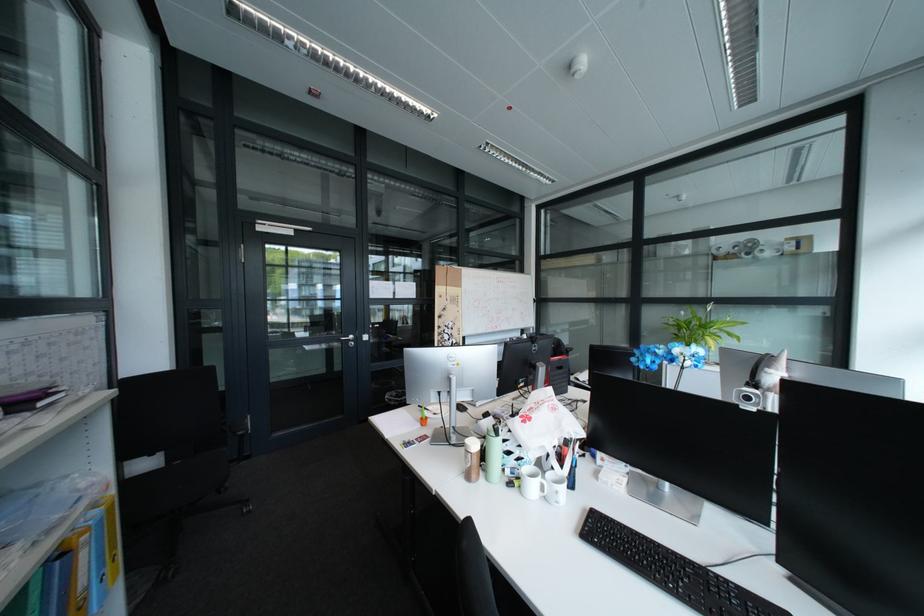
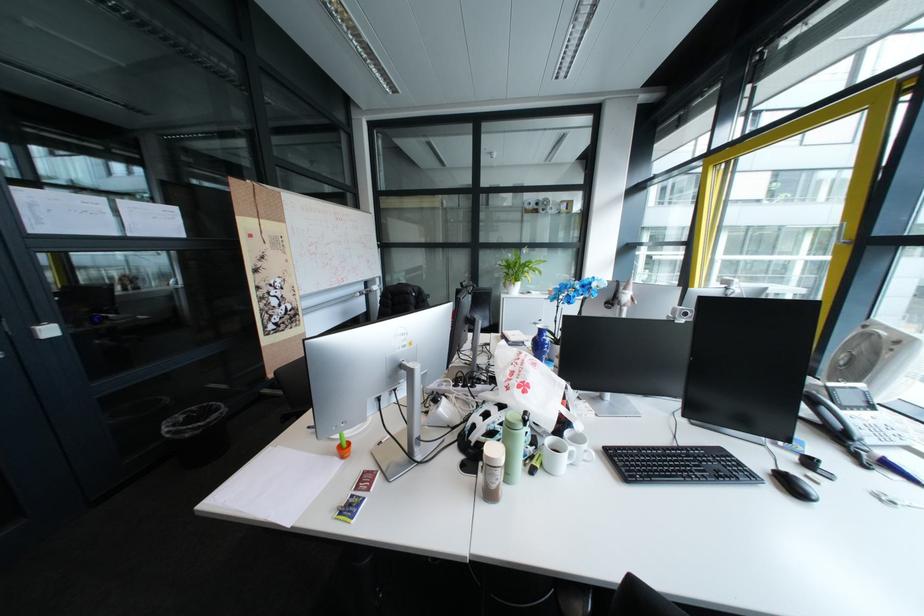
Locate, in the second image, the point that corresponds to the point at 481,464 in the first image.

(507, 484)